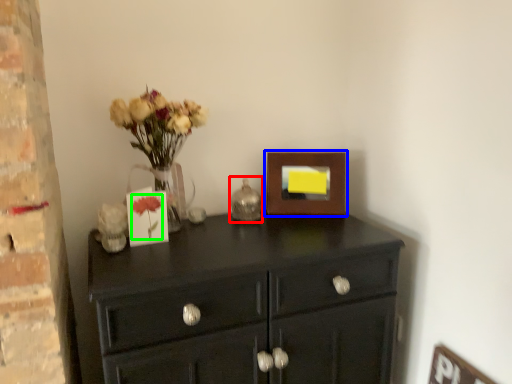
Question: Which object is the farthest from candle holder (highlighted by a red box)? Choose among these: picture frame (highlighted by a blue box) or flower (highlighted by a green box).

Choices:
 (A) picture frame
 (B) flower

Answer: (B)